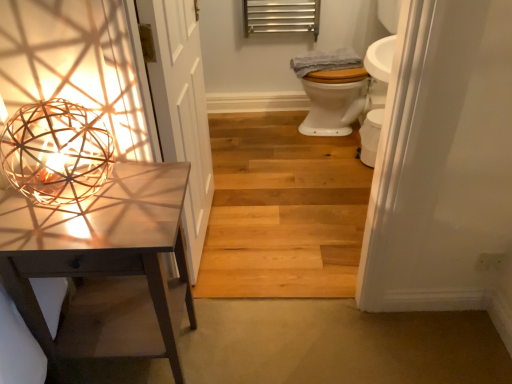
I want to click on empty space that is to the right of woven wood sphere at left, so click(x=141, y=207).